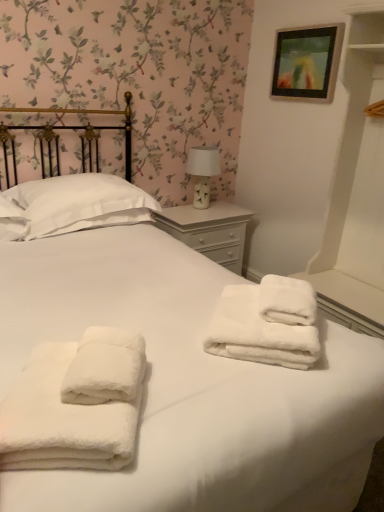
The image size is (384, 512). What are the coordinates of `vacant space in front of white ceramic table lamp at upper right` in the screenshot? It's located at (x=205, y=214).